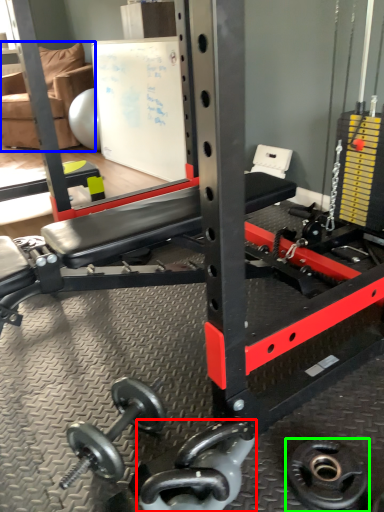
Question: Considering the real-world distances, which object is farthest from dumbbell (highlighted by a red box)? chair (highlighted by a blue box) or wheel (highlighted by a green box)?

Choices:
 (A) chair
 (B) wheel

Answer: (A)